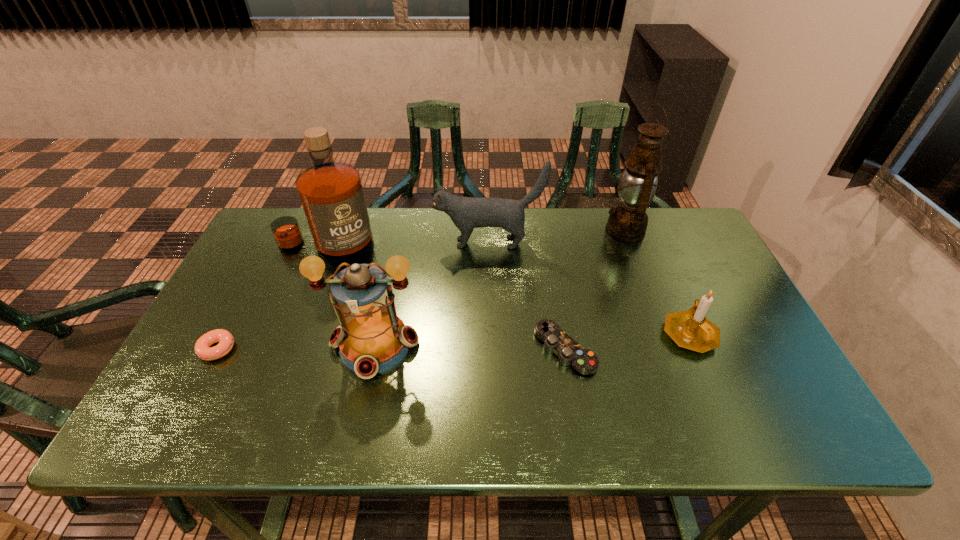
The width and height of the screenshot is (960, 540). Find the location of `doughnut at the left edge`. doughnut at the left edge is located at coordinates (202, 348).

Image resolution: width=960 pixels, height=540 pixels. In order to click on object located at the right edge in this screenshot , I will do click(x=690, y=329).

At what (x,y) coordinates should I click in order to perform the action: click on object situated at the far left corner. Please return your answer as a coordinate pair (x, y). Looking at the image, I should click on (331, 193).

In the image, there is a desktop. In order to click on vacant space at the far edge in this screenshot , I will do `click(414, 214)`.

In the image, there is a desktop. Where is `free space at the near edge`? This screenshot has height=540, width=960. free space at the near edge is located at coordinates (264, 406).

The width and height of the screenshot is (960, 540). In the image, there is a desktop. Find the location of `blank space at the left edge`. blank space at the left edge is located at coordinates (281, 259).

Image resolution: width=960 pixels, height=540 pixels. In order to click on vacant space at the right edge of the desktop in this screenshot , I will do `click(714, 309)`.

This screenshot has width=960, height=540. What are the coordinates of `vacant space at the near left corner` in the screenshot? It's located at (143, 430).

Identify the location of free space at the near right corner of the desktop. This screenshot has width=960, height=540. (746, 408).

This screenshot has height=540, width=960. Identify the location of vacant space that is in between the oil lamp and the liquor. (475, 239).